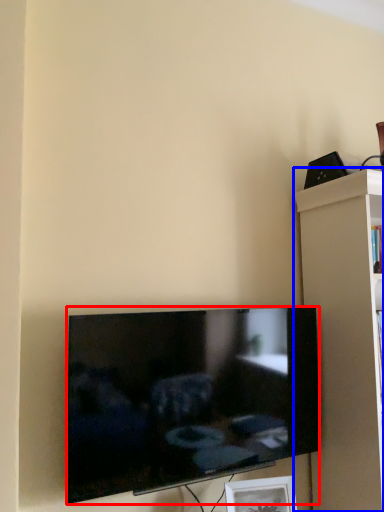
Question: Which object appears farthest to the camera in this image, television (highlighted by a red box) or shelf (highlighted by a blue box)?

Choices:
 (A) television
 (B) shelf

Answer: (B)